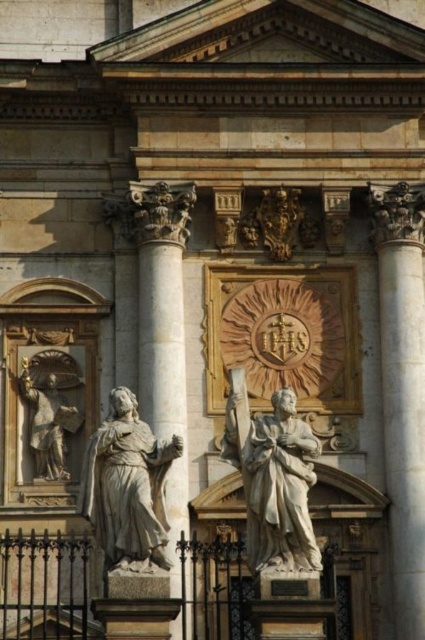
You are an architect examining the classical building facade. You notice the white marble column at right and the white marble column at center. Which column is taller?

The white marble column at right is taller than the white marble column at center according to the description.

You are an art student analyzing the facade of a classical building. You notice two statues, the white marble statue at center and the matte gray statue at left. Which statue is bigger?

The white marble statue at center is larger than the matte gray statue at left.

You are an architect planning to install a new decorative element between the white marble column at right and the matte gray statue at left. The element requires a minimum space of 45 feet to be placed. Based on the scene, will there be enough space for it?

The distance between the white marble column at right and the matte gray statue at left is 46.12 feet, which exceeds the required 45 feet. Therefore, there is sufficient space to install the decorative element between them.